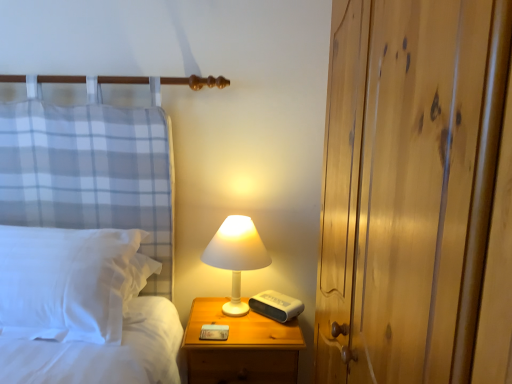
Question: Can you confirm if wooden nightstand at lower right is thinner than wooden dresser at right?

Choices:
 (A) no
 (B) yes

Answer: (A)

Question: From a real-world perspective, is wooden nightstand at lower right located higher than wooden dresser at right?

Choices:
 (A) no
 (B) yes

Answer: (A)

Question: Is wooden nightstand at lower right oriented towards wooden dresser at right?

Choices:
 (A) no
 (B) yes

Answer: (A)

Question: Is wooden nightstand at lower right placed right next to wooden dresser at right?

Choices:
 (A) no
 (B) yes

Answer: (A)

Question: Is wooden nightstand at lower right further to camera compared to wooden dresser at right?

Choices:
 (A) yes
 (B) no

Answer: (A)

Question: Is wooden nightstand at lower right taller than wooden dresser at right?

Choices:
 (A) yes
 (B) no

Answer: (B)

Question: Is wooden nightstand at lower right next to white soft pillow at left and touching it?

Choices:
 (A) yes
 (B) no

Answer: (B)

Question: Is wooden nightstand at lower right outside white soft pillow at left?

Choices:
 (A) yes
 (B) no

Answer: (A)

Question: Does wooden nightstand at lower right have a greater width compared to white soft pillow at left?

Choices:
 (A) yes
 (B) no

Answer: (A)

Question: Considering the relative sizes of wooden nightstand at lower right and white soft pillow at left in the image provided, is wooden nightstand at lower right thinner than white soft pillow at left?

Choices:
 (A) yes
 (B) no

Answer: (B)

Question: Does wooden nightstand at lower right turn towards white soft pillow at left?

Choices:
 (A) no
 (B) yes

Answer: (A)

Question: Considering the relative sizes of wooden nightstand at lower right and white soft pillow at left in the image provided, is wooden nightstand at lower right shorter than white soft pillow at left?

Choices:
 (A) no
 (B) yes

Answer: (A)

Question: Is white soft pillow at left not close to wooden nightstand at lower right?

Choices:
 (A) yes
 (B) no

Answer: (B)